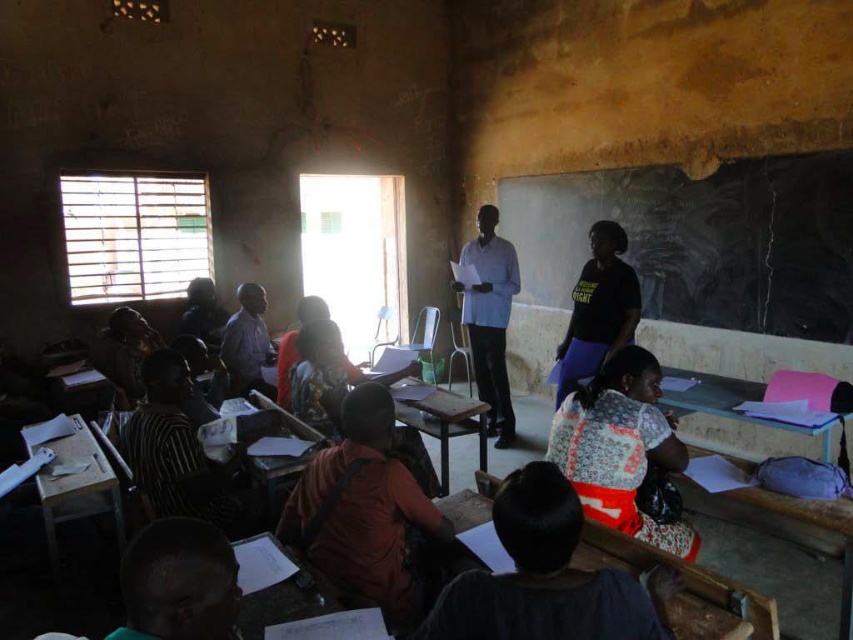
Which is below, white matte shirt at center or wooden table at center?

wooden table at center is below.

Is point (496, 292) in front of point (410, 388)?

No, it is not.

Where is `white matte shirt at center`? The width and height of the screenshot is (853, 640). white matte shirt at center is located at coordinates (490, 317).

Between white wooden table at lower left and wooden table at center, which one has less height?

With less height is white wooden table at lower left.

Can you confirm if white wooden table at lower left is positioned above wooden table at center?

Indeed, white wooden table at lower left is positioned over wooden table at center.

What are the coordinates of `white wooden table at lower left` in the screenshot? It's located at (74, 483).

Is black chalkboard at upper center further to camera compared to pink plastic table at lower right?

Yes, black chalkboard at upper center is behind pink plastic table at lower right.

What do you see at coordinates (701, 241) in the screenshot? I see `black chalkboard at upper center` at bounding box center [701, 241].

Find the location of a particular element. This screenshot has width=853, height=640. black chalkboard at upper center is located at coordinates (701, 241).